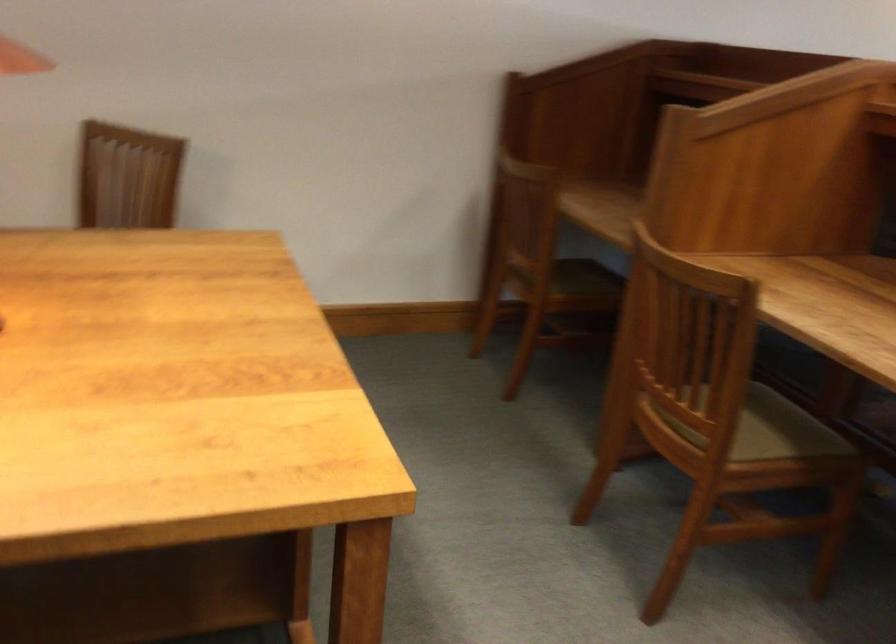
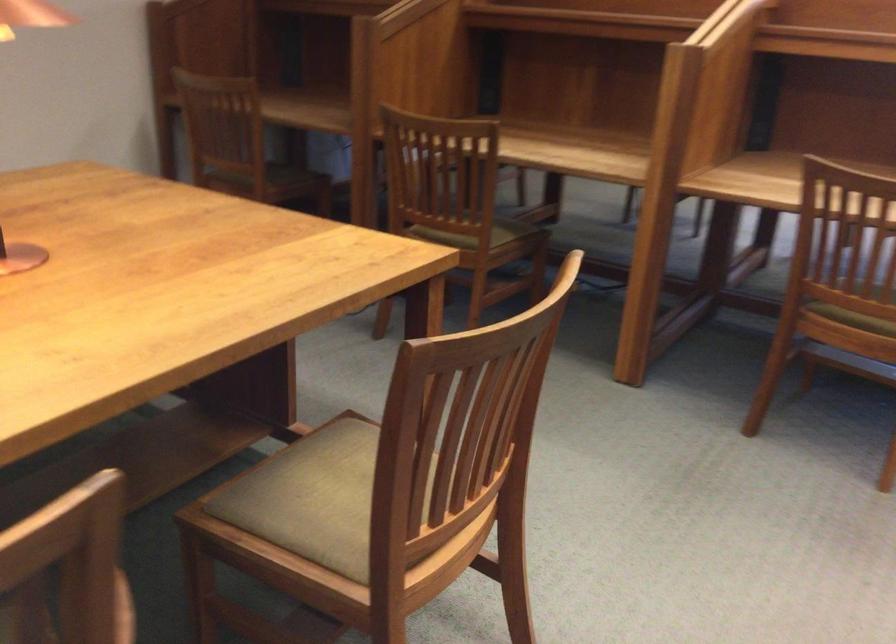
Where in the second image is the point corresponding to point (710, 439) from the first image?

(474, 234)